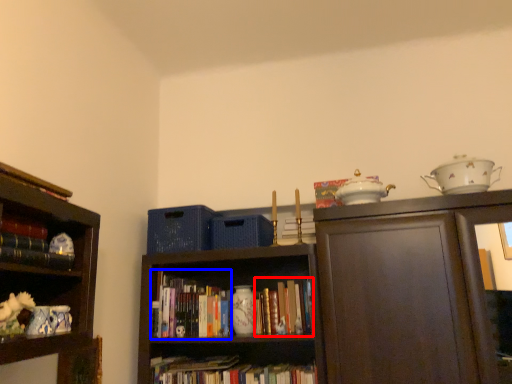
Question: Which object is further to the camera taking this photo, book (highlighted by a red box) or book (highlighted by a blue box)?

Choices:
 (A) book
 (B) book

Answer: (B)